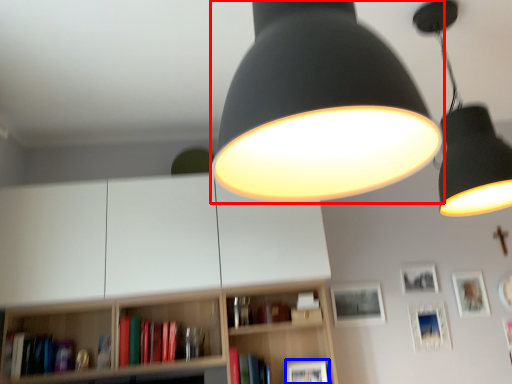
Question: Which object appears farthest to the camera in this image, lamp (highlighted by a red box) or picture frame (highlighted by a blue box)?

Choices:
 (A) lamp
 (B) picture frame

Answer: (B)